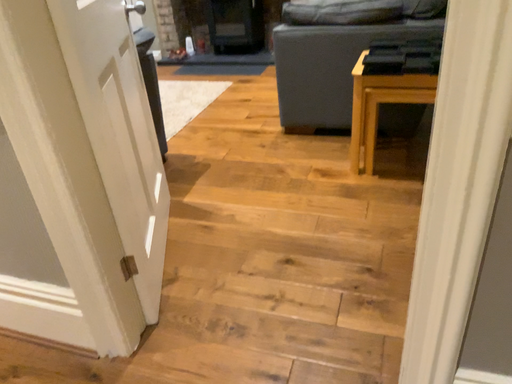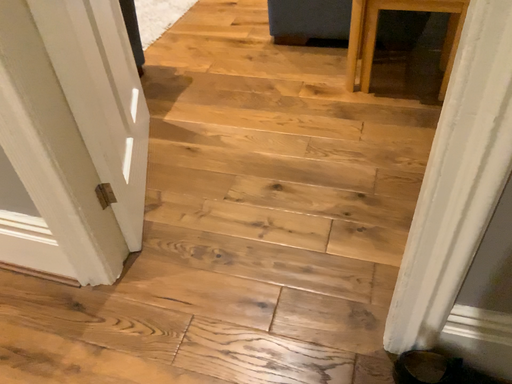
Question: Which way did the camera rotate in the video?

Choices:
 (A) rotated upward
 (B) rotated downward

Answer: (B)